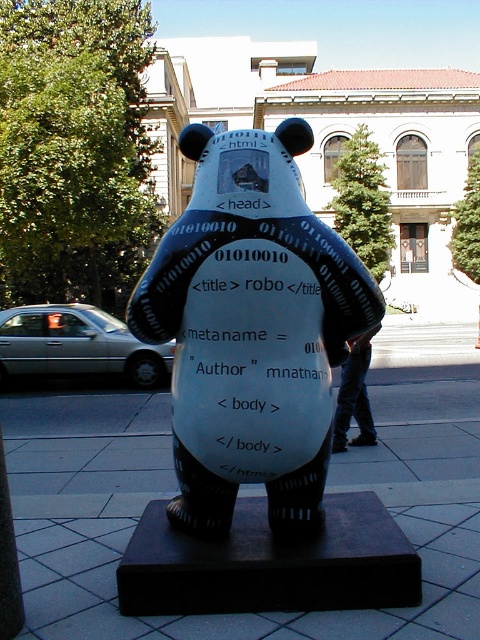
Question: Is the position of white glossy bear at center less distant than that of smooth concrete pavement at center?

Choices:
 (A) yes
 (B) no

Answer: (B)

Question: From the image, what is the correct spatial relationship of white glossy bear at center in relation to smooth concrete pavement at center?

Choices:
 (A) right
 (B) left

Answer: (B)

Question: Which of the following is the farthest from the observer?

Choices:
 (A) (255, 227)
 (B) (164, 634)

Answer: (A)

Question: Can you confirm if white glossy bear at center is positioned above smooth concrete pavement at center?

Choices:
 (A) no
 (B) yes

Answer: (B)

Question: Which point is closer to the camera?

Choices:
 (A) (468, 461)
 (B) (249, 356)

Answer: (B)